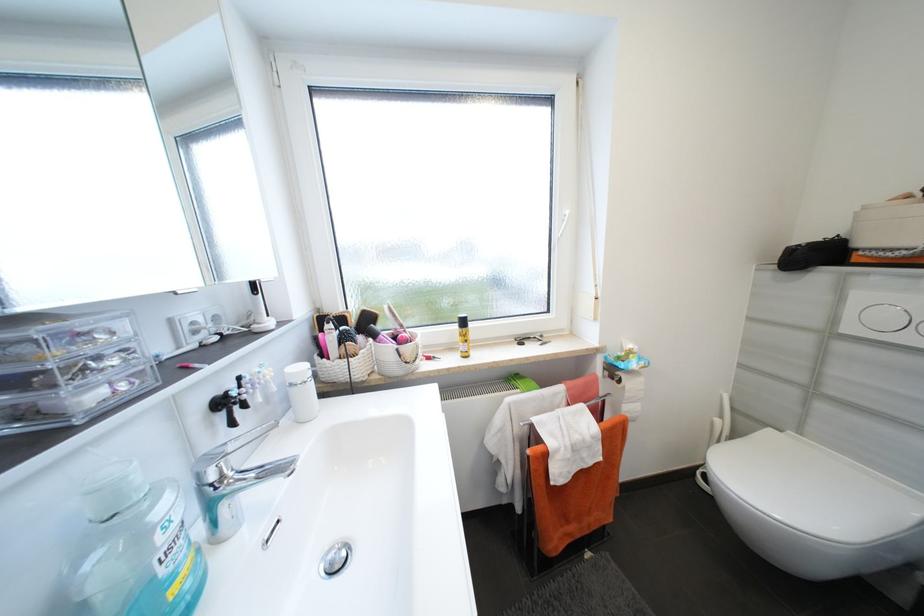
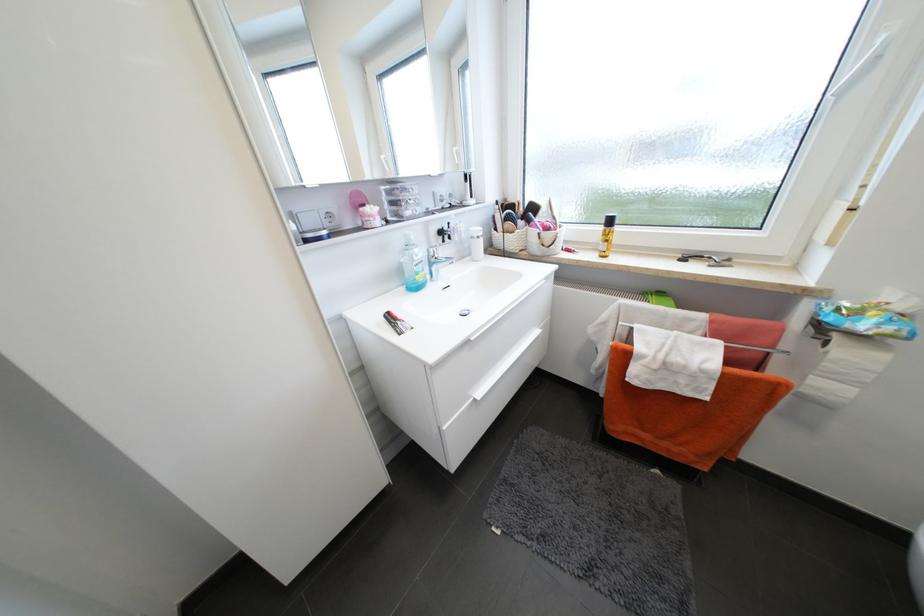
Find the pixel in the second image that matches pixel 573 214 in the first image.

(888, 41)